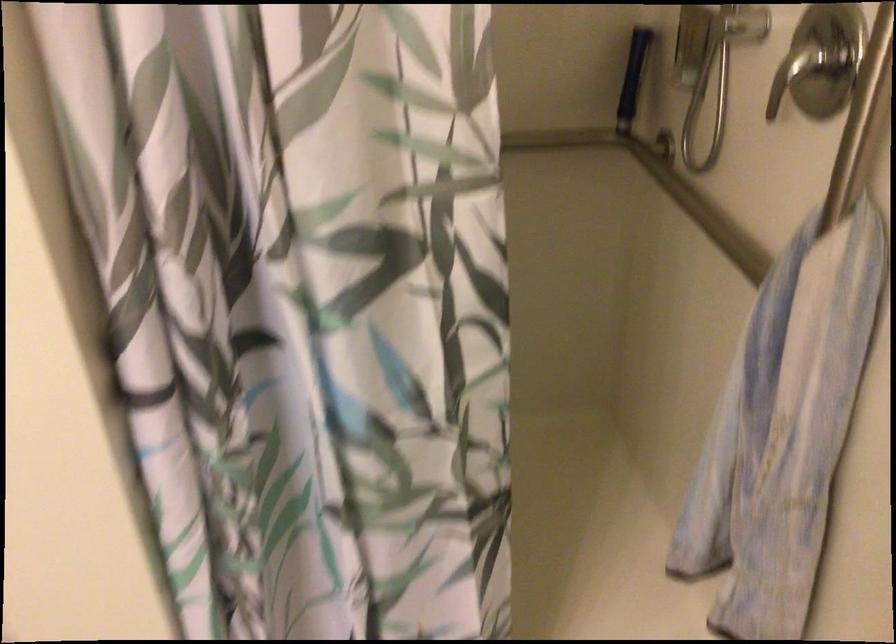
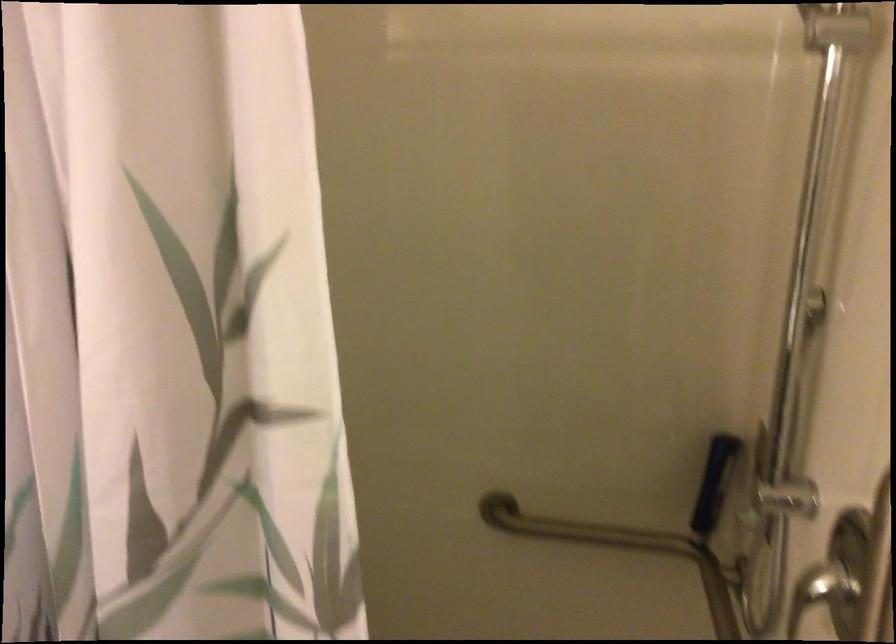
Question: The images are taken continuously from a first-person perspective. In which direction are you moving?

Choices:
 (A) Left
 (B) Right
 (C) Forward
 (D) Backward

Answer: (B)